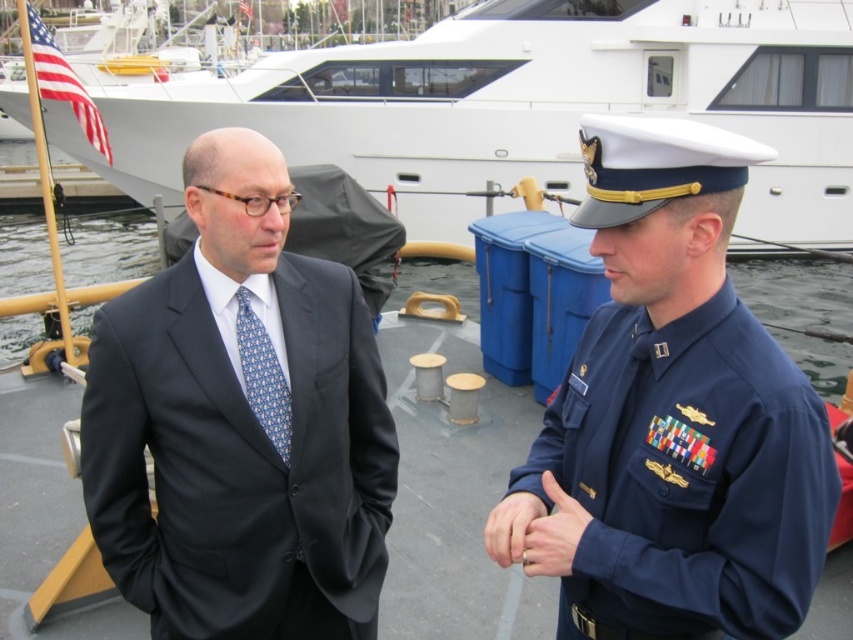
You are a photographer positioned at the dock. You need to take a photo of both the matte black suit at center and the smooth skin hand at center. Which object should you focus on first if you want to ensure both are in the frame without moving the camera?

The matte black suit at center is to the left of smooth skin hand at center, so you should focus on the matte black suit at center first to ensure both are in the frame without moving the camera.

You are a photographer trying to capture a photo of the matte black suit at center and the white glossy yacht at upper center. Since you want both subjects to be clearly visible, you need to ensure they are within the camera frame. Given that the camera has a fixed focal length, which subject should you prioritize positioning closer to the camera to maintain clarity?

The matte black suit at center has a lesser width compared to the white glossy yacht at upper center. To ensure both are clearly visible, prioritize positioning the wider white glossy yacht at upper center closer to the camera since it requires more space in the frame due to its larger size.